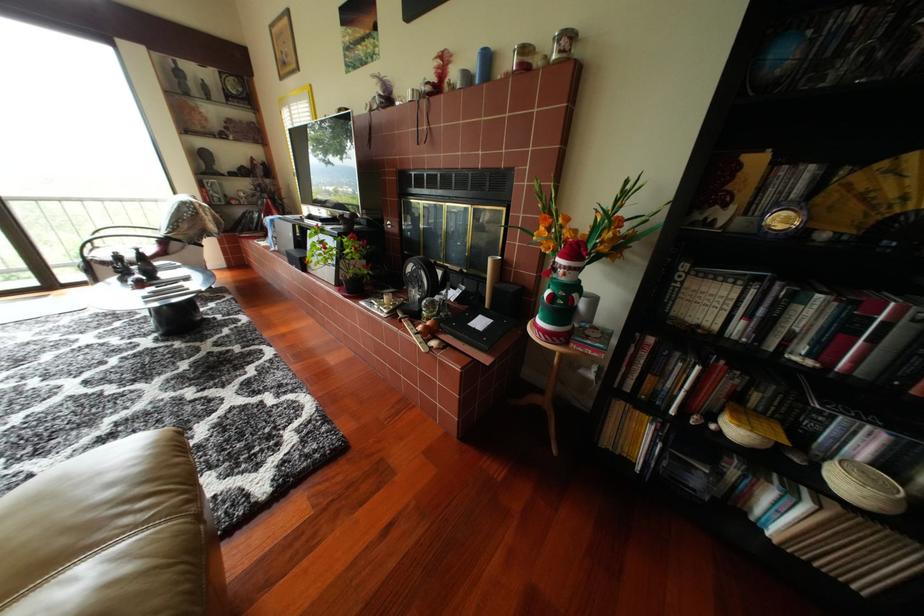
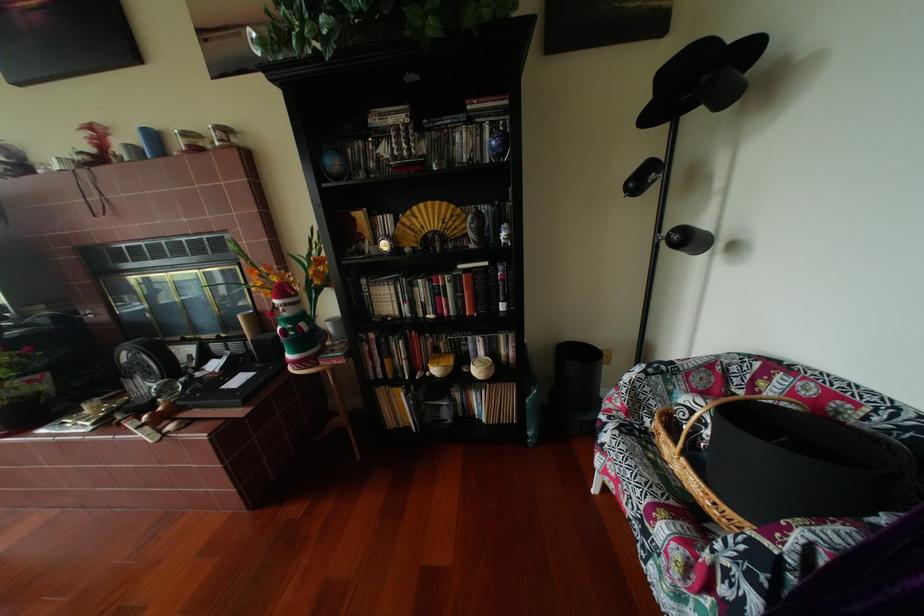
In the second image, find the point that corresponds to pixel 481 78 in the first image.

(149, 152)